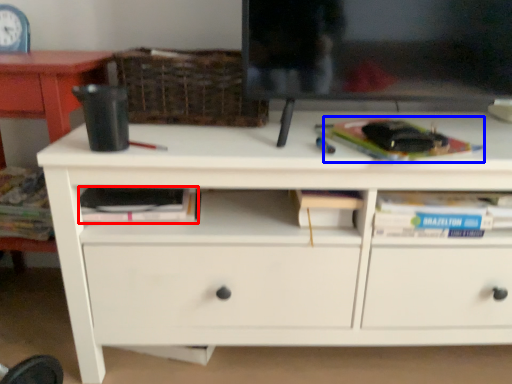
Question: Among these objects, which one is farthest to the camera, paperback book (highlighted by a red box) or paperback book (highlighted by a blue box)?

Choices:
 (A) paperback book
 (B) paperback book

Answer: (A)